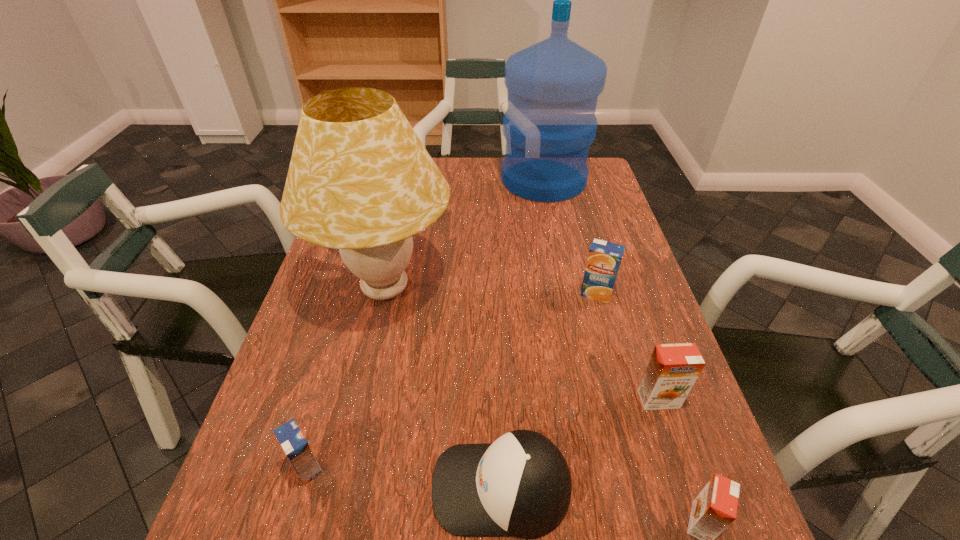
Where is `water jug`? water jug is located at coordinates [x=553, y=86].

At what (x,y) coordinates should I click in order to perform the action: click on the farthest object. Please return your answer as a coordinate pair (x, y). Looking at the image, I should click on (553, 86).

Locate an element on the screen. The width and height of the screenshot is (960, 540). yellow lampshade is located at coordinates (360, 180).

Identify the location of the fourth nearest object. This screenshot has height=540, width=960. (673, 369).

This screenshot has height=540, width=960. Identify the location of the farther orange orange juice. (673, 369).

The image size is (960, 540). In order to click on the farthest orange juice in this screenshot , I will do `click(604, 258)`.

In order to click on the right blue orange_juice in this screenshot , I will do `click(604, 258)`.

Find the location of `gray cap`. gray cap is located at coordinates (520, 485).

Locate an element on the screen. the third farthest orange juice is located at coordinates (293, 442).

Locate an element on the screen. The width and height of the screenshot is (960, 540). the leftmost orange juice is located at coordinates (293, 442).